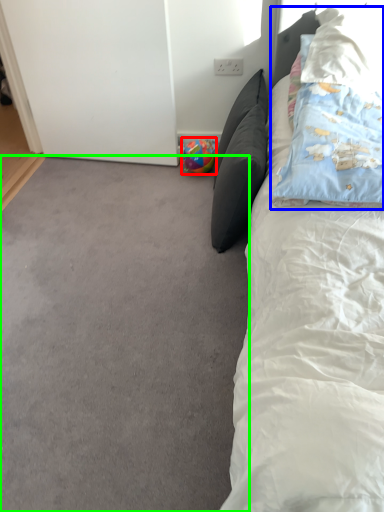
Question: Which object is the closest to the toy (highlighted by a red box)? Choose among these: pillow (highlighted by a blue box) or plain (highlighted by a green box).

Choices:
 (A) pillow
 (B) plain

Answer: (A)